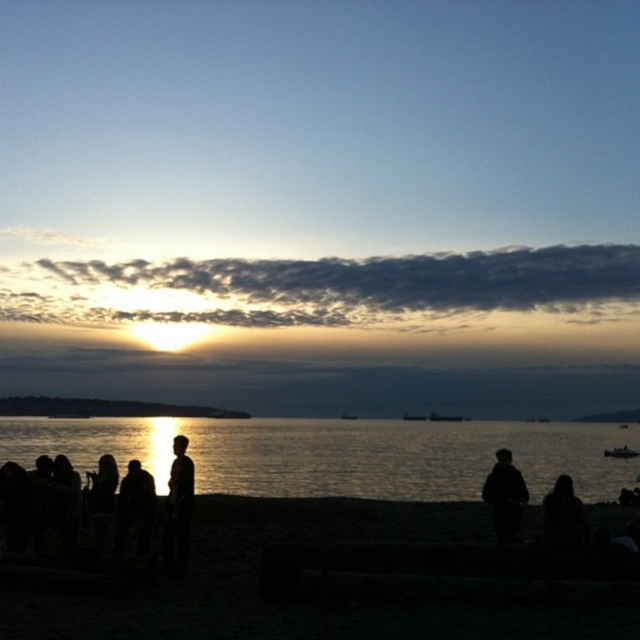
Question: Which point appears farthest from the camera in this image?

Choices:
 (A) (476, 486)
 (B) (612, 451)
 (C) (300, 545)

Answer: (B)

Question: Does silhouette figure at center appear over metallic silver boat at lower right?

Choices:
 (A) no
 (B) yes

Answer: (B)

Question: Which of these objects is positioned farthest from the glistening water at lower center?

Choices:
 (A) black sand at lower center
 (B) metallic silver boat at lower right
 (C) dark matte jacket at center
 (D) silhouette figure at center

Answer: (D)

Question: Which point is closer to the camera?

Choices:
 (A) (618, 456)
 (B) (28, 442)

Answer: (A)

Question: Is dark matte jacket at center below silhouette figure at center?

Choices:
 (A) yes
 (B) no

Answer: (A)

Question: Can you confirm if glistening water at lower center is smaller than silhouette figure at center?

Choices:
 (A) no
 (B) yes

Answer: (A)